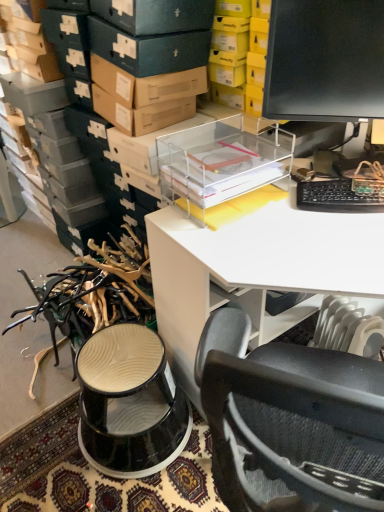
What is the approximate height of black glossy monitor at upper right?

It is 22.78 inches.

What do you see at coordinates (325, 60) in the screenshot? This screenshot has height=512, width=384. I see `black glossy monitor at upper right` at bounding box center [325, 60].

You are a GUI agent. You are given a task and a screenshot of the screen. Output one action in this format:
    pyautogui.click(x=<x>, y=<y>)
    Task: Click on the transparent plastic desk at upper center
    
    Given the screenshot: What is the action you would take?
    pyautogui.click(x=255, y=270)

Consider the image. Is black plastic keyboard at right bigger or smaller than transparent plastic desk at upper center?

In the image, black plastic keyboard at right appears to be smaller than transparent plastic desk at upper center.

How different are the orientations of black plastic keyboard at right and transparent plastic desk at upper center in degrees?

45.9 degrees.

Is black plastic keyboard at right with transparent plastic desk at upper center?

No, black plastic keyboard at right is not touching transparent plastic desk at upper center.

From a real-world perspective, is black plastic keyboard at right beneath transparent plastic desk at upper center?

No.

Is transparent plastic desk at upper center taller or shorter than black plastic keyboard at right?

Clearly, transparent plastic desk at upper center is taller compared to black plastic keyboard at right.

From a real-world perspective, which is physically below, transparent plastic desk at upper center or black plastic keyboard at right?

transparent plastic desk at upper center, from a real-world perspective.

From the image's perspective, is transparent plastic desk at upper center located above or below black plastic keyboard at right?

transparent plastic desk at upper center is situated lower than black plastic keyboard at right in the image.

Locate an element on the screen. The height and width of the screenshot is (512, 384). computer keyboard behind the transparent plastic desk at upper center is located at coordinates coord(335,197).

Is point (308, 187) farther from camera compared to point (340, 104)?

No, it is not.

From their relative heights in the image, would you say black plastic keyboard at right is taller or shorter than black glossy monitor at upper right?

Clearly, black plastic keyboard at right is shorter compared to black glossy monitor at upper right.

Is black plastic keyboard at right looking in the opposite direction of black glossy monitor at upper right?

Yes, black plastic keyboard at right is facing away from black glossy monitor at upper right.

Is black glossy monitor at upper right in contact with black plastic keyboard at right?

black glossy monitor at upper right and black plastic keyboard at right are not in contact.

Considering the positions of objects black glossy monitor at upper right and black plastic keyboard at right in the image provided, who is more to the right, black glossy monitor at upper right or black plastic keyboard at right?

Positioned to the right is black plastic keyboard at right.

Is black glossy monitor at upper right positioned with its back to black plastic keyboard at right?

No.

Does black glossy monitor at upper right have a greater width compared to black plastic keyboard at right?

In fact, black glossy monitor at upper right might be narrower than black plastic keyboard at right.

Is transparent plastic desk at upper center further to camera compared to black glossy monitor at upper right?

No, transparent plastic desk at upper center is closer to the camera.

How much distance is there between transparent plastic desk at upper center and black glossy monitor at upper right?

transparent plastic desk at upper center and black glossy monitor at upper right are 20.01 inches apart from each other.

Are transparent plastic desk at upper center and black glossy monitor at upper right beside each other?

No.

Can you confirm if transparent plastic desk at upper center is smaller than black glossy monitor at upper right?

No.

Is black glossy monitor at upper right positioned with its back to transparent plastic desk at upper center?

black glossy monitor at upper right does not have its back to transparent plastic desk at upper center.

Can you confirm if black glossy monitor at upper right is wider than transparent plastic desk at upper center?

No.

Which object is positioned more to the left, black glossy monitor at upper right or transparent plastic desk at upper center?

black glossy monitor at upper right.

The image size is (384, 512). Find the location of `desk that appears below the black plastic keyboard at right (from the image's perspective)`. desk that appears below the black plastic keyboard at right (from the image's perspective) is located at coordinates (255, 270).

The width and height of the screenshot is (384, 512). I want to click on desk below the black plastic keyboard at right (from a real-world perspective), so click(x=255, y=270).

Estimate the real-world distances between objects in this image. Which object is closer to transparent plastic desk at upper center, black plastic keyboard at right or black glossy monitor at upper right?

black plastic keyboard at right is closer to transparent plastic desk at upper center.

Which object lies nearer to the anchor point black glossy monitor at upper right, transparent plastic desk at upper center or black plastic keyboard at right?

black plastic keyboard at right lies closer to black glossy monitor at upper right than the other object.

From the image, which object appears to be nearer to transparent plastic desk at upper center, black glossy monitor at upper right or black plastic keyboard at right?

black plastic keyboard at right is closer to transparent plastic desk at upper center.

Which object lies further to the anchor point black glossy monitor at upper right, black plastic keyboard at right or transparent plastic desk at upper center?

transparent plastic desk at upper center lies further to black glossy monitor at upper right than the other object.

From the picture: When comparing their distances from black plastic keyboard at right, does black glossy monitor at upper right or transparent plastic desk at upper center seem closer?

transparent plastic desk at upper center lies closer to black plastic keyboard at right than the other object.

In the scene shown: From the image, which object appears to be nearer to black plastic keyboard at right, transparent plastic desk at upper center or black glossy monitor at upper right?

transparent plastic desk at upper center lies closer to black plastic keyboard at right than the other object.

Where is `computer keyboard that lies between black glossy monitor at upper right and transparent plastic desk at upper center from top to bottom`? computer keyboard that lies between black glossy monitor at upper right and transparent plastic desk at upper center from top to bottom is located at coordinates (335, 197).